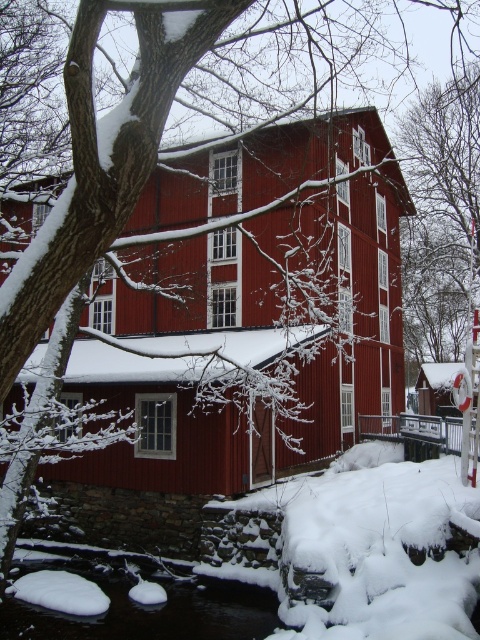
Question: Which point is farther to the camera?

Choices:
 (A) (339, 221)
 (B) (240, 627)

Answer: (A)

Question: Can you confirm if matte red barn at center is thinner than black ice at lower center?

Choices:
 (A) yes
 (B) no

Answer: (B)

Question: Which point appears closest to the camera in this image?

Choices:
 (A) (343, 384)
 (B) (192, 637)

Answer: (B)

Question: Can you confirm if matte red barn at center is positioned above black ice at lower center?

Choices:
 (A) yes
 (B) no

Answer: (A)

Question: Among these points, which one is nearest to the camera?

Choices:
 (A) (229, 257)
 (B) (79, 572)

Answer: (B)

Question: Does matte red barn at center have a smaller size compared to black ice at lower center?

Choices:
 (A) no
 (B) yes

Answer: (A)